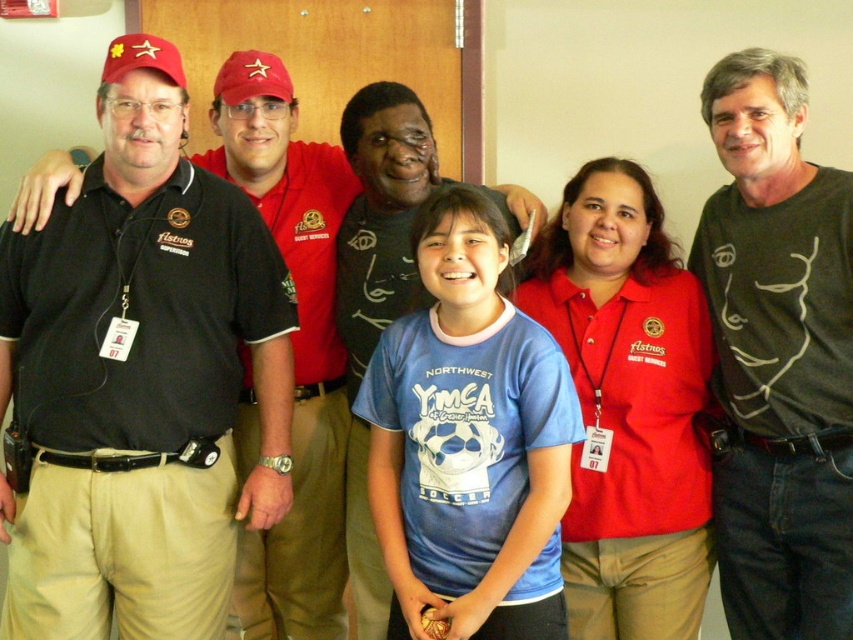
You are organizing a group photo and need to ensure there is enough space between the black matte shirt at right and the black shirt at left for a banner to hang between them. The banner requires a minimum of 30 inches of space. Based on the image, will the banner fit between them?

The distance between the black matte shirt at right and the black shirt at left is 28.33 inches, which is less than the required 30 inches. Therefore, the banner will not fit between them.

You are a photographer trying to adjust the spacing between the black matte shirt at right and the blue cotton shirt at center for a better composition. The current distance between them is 22.51 inches. If you want to reduce the distance by half, what should the new distance be?

The current distance between the black matte shirt at right and the blue cotton shirt at center is 22.51 inches. To reduce it by half, the new distance should be 11.255 inches.